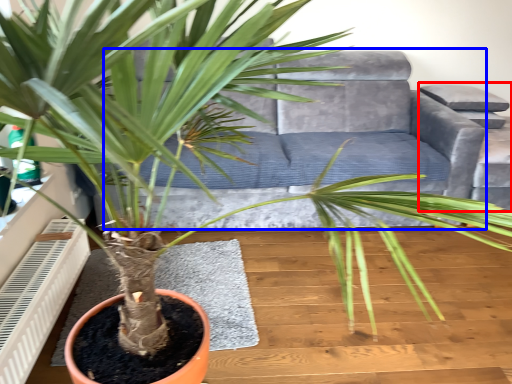
Question: Which of the following is the closest to the observer, armchair (highlighted by a red box) or couch (highlighted by a blue box)?

Choices:
 (A) armchair
 (B) couch

Answer: (B)